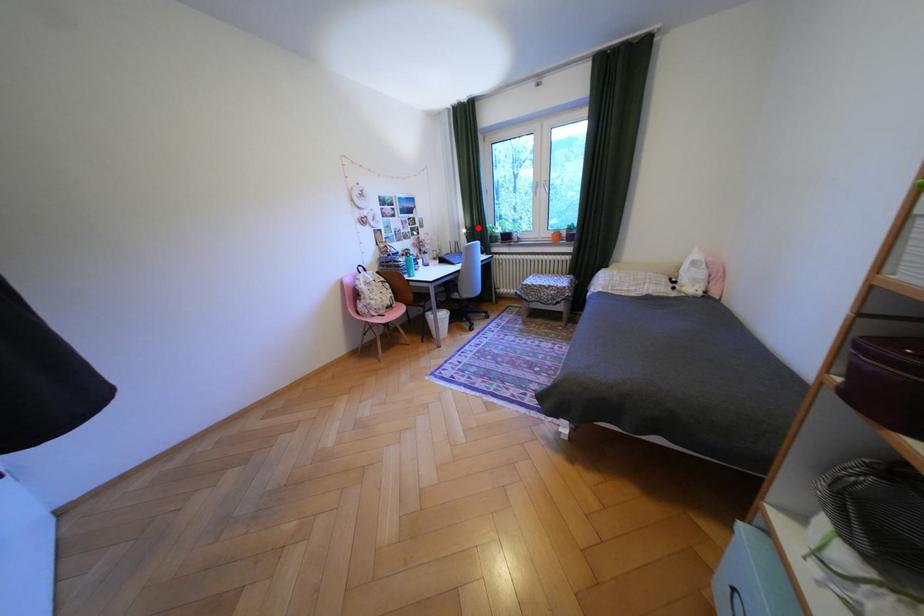
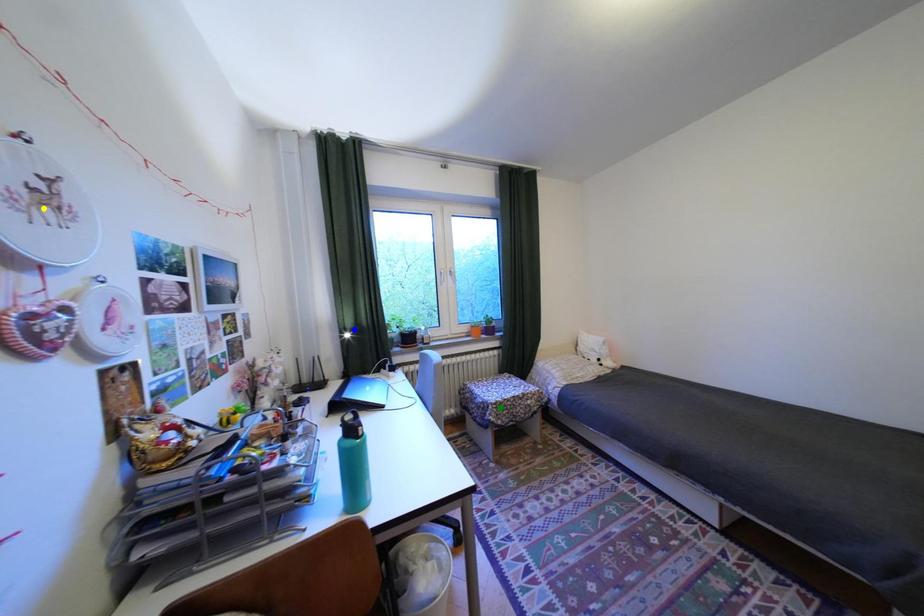
Question: I am providing you with two images of the same scene from different viewpoints. A red point is marked on the first image. You are given multiple points on the second image. Which point in image 2 represents the same 3d spot as the red point in image 1?

Choices:
 (A) blue point
 (B) yellow point
 (C) green point

Answer: (A)